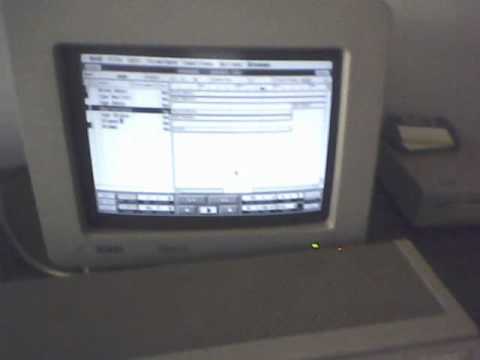
Find the location of a particular element. The height and width of the screenshot is (360, 480). cord is located at coordinates (27, 262).